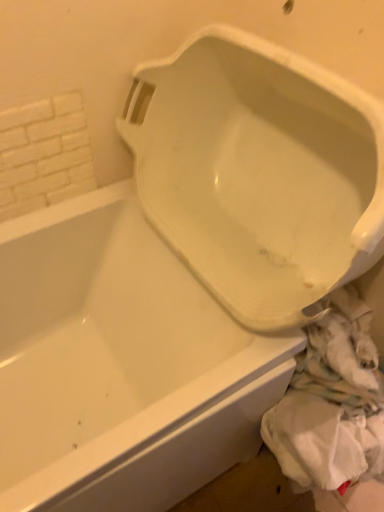
Question: Is white glossy urinal at center bigger or smaller than white brick wall at upper left?

Choices:
 (A) small
 (B) big

Answer: (B)

Question: Based on their positions, is white glossy urinal at center located to the left or right of white brick wall at upper left?

Choices:
 (A) right
 (B) left

Answer: (A)

Question: Which object is the closest to the white brick wall at upper left?

Choices:
 (A) white glossy urinal at center
 (B) white fabric at lower right

Answer: (A)

Question: Which object is the closest to the white brick wall at upper left?

Choices:
 (A) white fabric at lower right
 (B) white glossy urinal at center

Answer: (B)